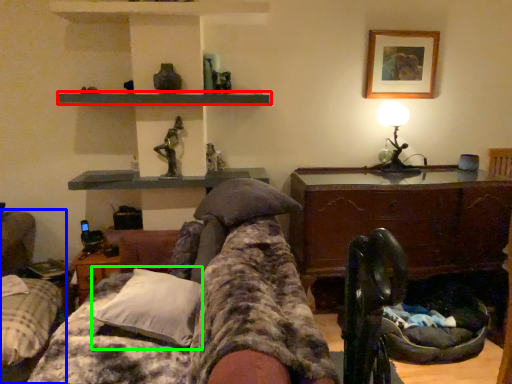
Question: Based on their relative distances, which object is nearer to shelf (highlighted by a red box)? Choose from furniture (highlighted by a blue box) and pillow (highlighted by a green box).

Choices:
 (A) furniture
 (B) pillow

Answer: (B)